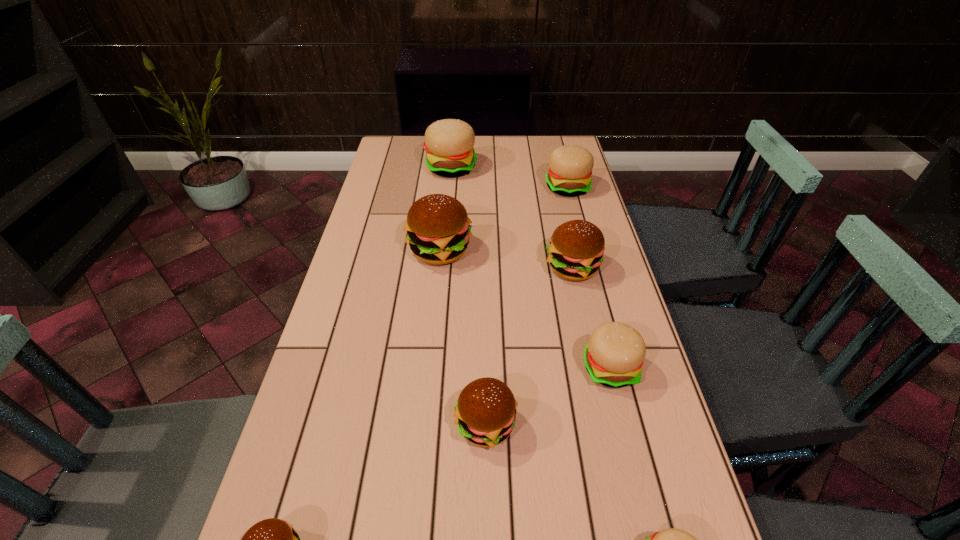
At what (x,y) coordinates should I click in order to perform the action: click on free point that satisfies the following two spatial constraints: 1. on the front side of the biggest beige hamburger; 2. on the right side of the sixth farthest hamburger. Please return your answer as a coordinate pair (x, y). The width and height of the screenshot is (960, 540). Looking at the image, I should click on (427, 424).